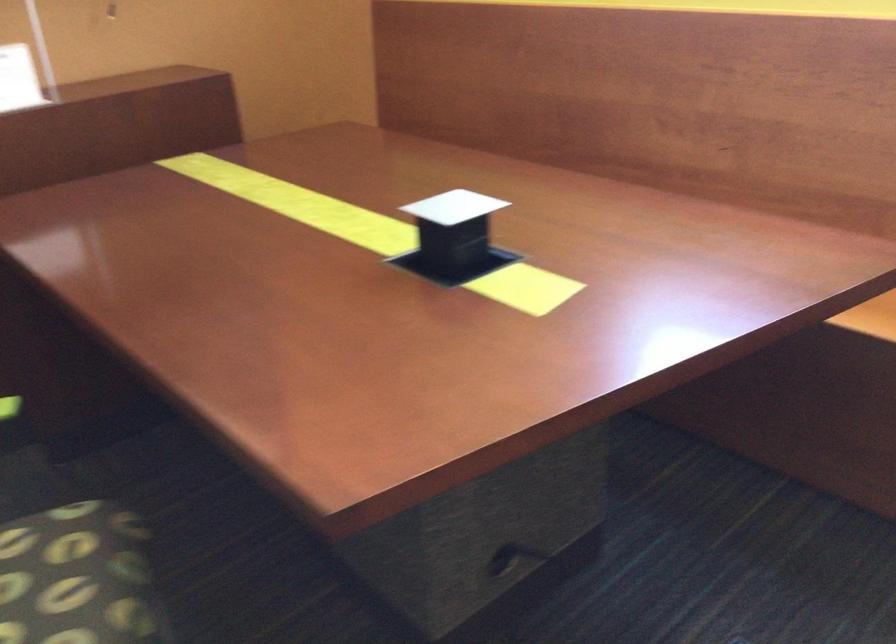
Find where to push the pop-up outlet top. Please return your answer as a coordinate pair (x, y).

(453, 207)